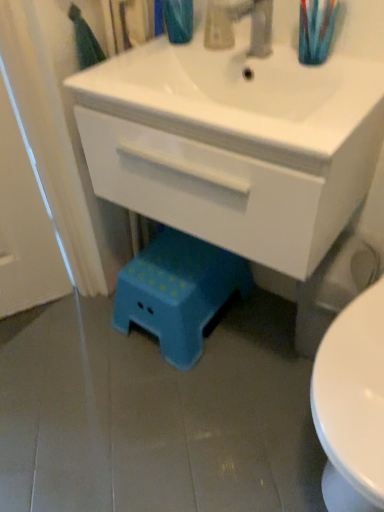
Question: Can you confirm if translucent plastic toothbrush at upper right is wider than translucent plastic soap dispenser at upper center?

Choices:
 (A) yes
 (B) no

Answer: (A)

Question: Is translucent plastic toothbrush at upper right in front of translucent plastic soap dispenser at upper center?

Choices:
 (A) no
 (B) yes

Answer: (B)

Question: From the image's perspective, is translucent plastic toothbrush at upper right over translucent plastic soap dispenser at upper center?

Choices:
 (A) no
 (B) yes

Answer: (A)

Question: From a real-world perspective, is translucent plastic toothbrush at upper right physically above translucent plastic soap dispenser at upper center?

Choices:
 (A) yes
 (B) no

Answer: (A)

Question: Considering the relative sizes of translucent plastic toothbrush at upper right and translucent plastic soap dispenser at upper center in the image provided, is translucent plastic toothbrush at upper right thinner than translucent plastic soap dispenser at upper center?

Choices:
 (A) yes
 (B) no

Answer: (B)

Question: Is point (301, 170) positioned closer to the camera than point (271, 47)?

Choices:
 (A) closer
 (B) farther

Answer: (A)

Question: Is white glossy cabinet at center wider or thinner than metallic silver faucet at upper center?

Choices:
 (A) thin
 (B) wide

Answer: (B)

Question: From the image's perspective, is white glossy cabinet at center above or below metallic silver faucet at upper center?

Choices:
 (A) below
 (B) above

Answer: (A)

Question: Based on their sizes in the image, would you say white glossy cabinet at center is bigger or smaller than metallic silver faucet at upper center?

Choices:
 (A) big
 (B) small

Answer: (A)

Question: From the image's perspective, relative to metallic silver faucet at upper center, is translucent plastic toothbrush at upper right above or below?

Choices:
 (A) below
 (B) above

Answer: (A)

Question: Considering the positions of translucent plastic toothbrush at upper right and metallic silver faucet at upper center in the image, is translucent plastic toothbrush at upper right bigger or smaller than metallic silver faucet at upper center?

Choices:
 (A) big
 (B) small

Answer: (B)

Question: From a real-world perspective, is translucent plastic toothbrush at upper right positioned above or below metallic silver faucet at upper center?

Choices:
 (A) below
 (B) above

Answer: (B)

Question: Is translucent plastic toothbrush at upper right situated inside metallic silver faucet at upper center or outside?

Choices:
 (A) outside
 (B) inside

Answer: (A)

Question: From their relative heights in the image, would you say white glossy cabinet at center is taller or shorter than blue plastic step stool at lower center?

Choices:
 (A) tall
 (B) short

Answer: (A)

Question: From a real-world perspective, is white glossy cabinet at center physically located above or below blue plastic step stool at lower center?

Choices:
 (A) above
 (B) below

Answer: (A)